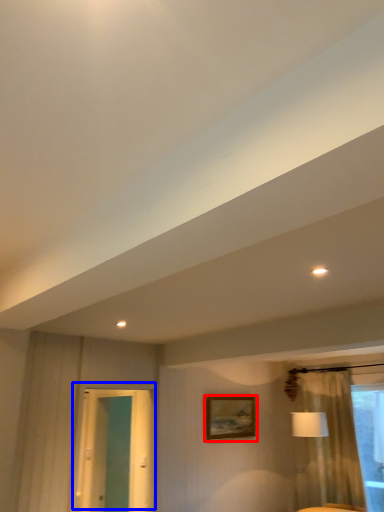
Question: Which point is closer to the camera, picture frame (highlighted by a red box) or door (highlighted by a blue box)?

Choices:
 (A) picture frame
 (B) door

Answer: (B)